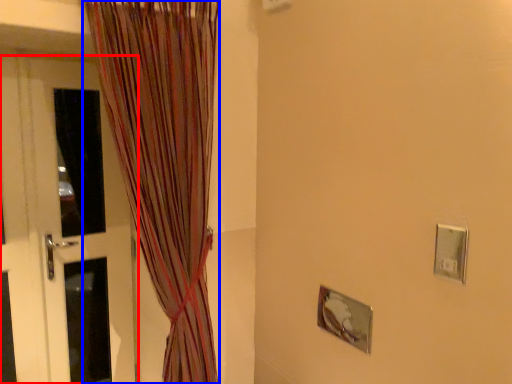
Question: Which object is further to the camera taking this photo, door (highlighted by a red box) or curtain (highlighted by a blue box)?

Choices:
 (A) door
 (B) curtain

Answer: (A)